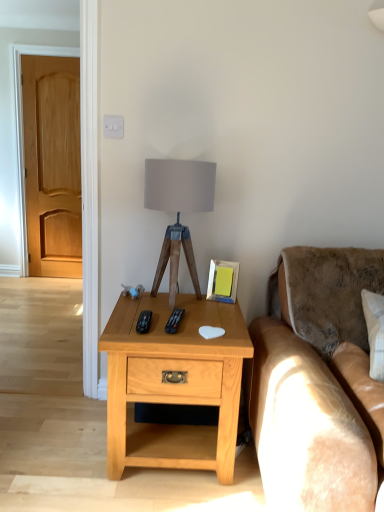
This screenshot has height=512, width=384. In order to click on free space to the right of black plastic remote at center, the 1th remote viewed from the left in this screenshot , I will do `click(198, 326)`.